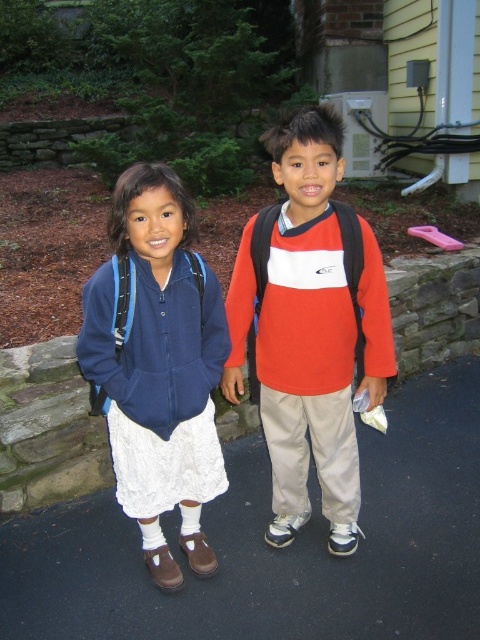
Between matte red sweater at center and matte blue backpack at left, which one is positioned higher?

Positioned higher is matte red sweater at center.

Which is behind, point (348, 422) or point (163, 204)?

The point (348, 422) is more distant.

Between point (284, 285) and point (186, 310), which one is positioned behind?

The point (284, 285) is behind.

Find the location of a particular element. matte red sweater at center is located at coordinates (310, 332).

This screenshot has height=640, width=480. Describe the element at coordinates (282, 548) in the screenshot. I see `black asphalt pavement at lower center` at that location.

Is black asphalt pavement at lower center to the left of matte blue backpack at left from the viewer's perspective?

No, black asphalt pavement at lower center is not to the left of matte blue backpack at left.

Measure the distance between black asphalt pavement at lower center and camera.

black asphalt pavement at lower center is 2.01 meters from camera.

In order to click on black asphalt pavement at lower center in this screenshot , I will do `click(282, 548)`.

Between black asphalt pavement at lower center and matte red sweater at center, which one is positioned higher?

matte red sweater at center

Consider the image. Between black asphalt pavement at lower center and matte red sweater at center, which one appears on the left side from the viewer's perspective?

Positioned to the left is matte red sweater at center.

Between point (140, 605) and point (299, 157), which one is positioned in front?

Point (299, 157) is in front.

Identify the location of black asphalt pavement at lower center. (282, 548).